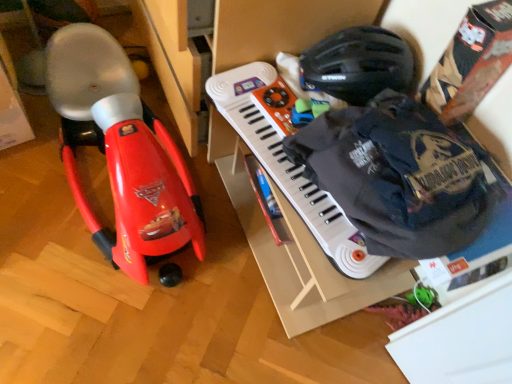
You are a GUI agent. You are given a task and a screenshot of the screen. Output one action in this format:
    pyautogui.click(x=<x>, y=<y>)
    Task: Click on the blank space situated above white plastic musical keyboard at center (from a real-world perspective)
    
    Given the screenshot: What is the action you would take?
    pyautogui.click(x=288, y=140)